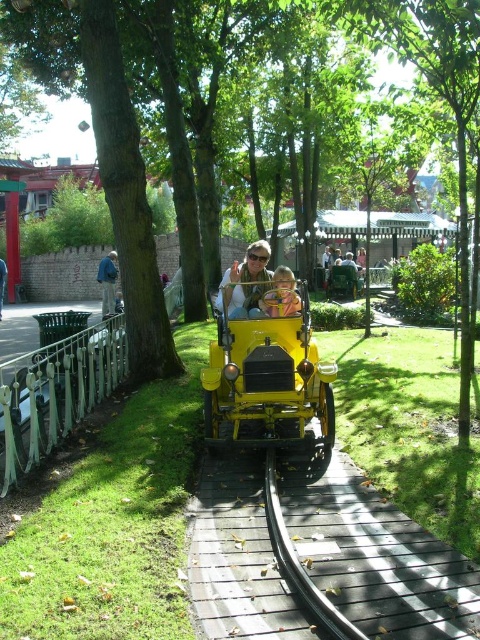
Question: Can you confirm if wooden at center is positioned below denim jacket at left?

Choices:
 (A) no
 (B) yes

Answer: (B)

Question: Which point is farther to the camera?

Choices:
 (A) pyautogui.click(x=245, y=278)
 (B) pyautogui.click(x=276, y=387)

Answer: (A)

Question: Considering the real-world distances, which object is closest to the denim jacket at left?

Choices:
 (A) matte yellow car at center
 (B) wooden at center

Answer: (B)

Question: Among these objects, which one is nearest to the camera?

Choices:
 (A) matte yellow car at center
 (B) wooden at center
 (C) shiny yellow toy car at center
 (D) matte black car at center

Answer: (B)

Question: Is matte yellow car at center bigger than denim jacket at left?

Choices:
 (A) no
 (B) yes

Answer: (A)

Question: Is wooden at center positioned at the back of shiny yellow toy car at center?

Choices:
 (A) yes
 (B) no

Answer: (B)